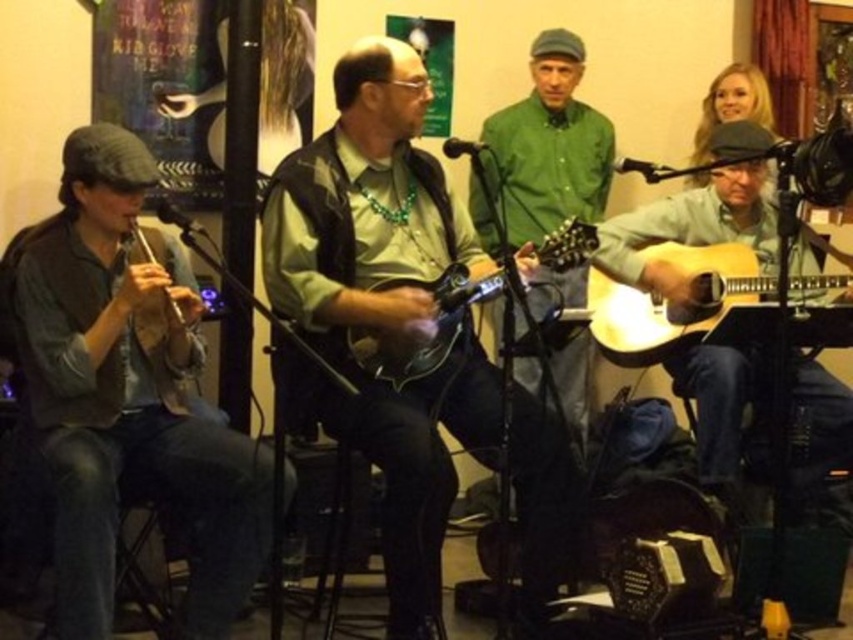
You are a photographer setting up for a live performance. You need to capture a clear shot of both the light brown wood guitar at right and the light wood acoustic guitar at right. Since you want to ensure both guitars are visible in the frame, which guitar should you focus on first to avoid blocking the view of the other?

The light brown wood guitar at right is positioned under the light wood acoustic guitar at right. Therefore, you should focus on the light wood acoustic guitar at right first, as it is above and might block the view of the one below if not properly framed.

You are a stagehand setting up a music performance. You have to place the green matte mandolin at center and the matte wood flute at left on a shelf. The shelf has limited space. Which instrument should you place first to ensure both fit properly?

The green matte mandolin at center is larger than the matte wood flute at left, so you should place the green matte mandolin at center first to ensure both fit on the shelf.